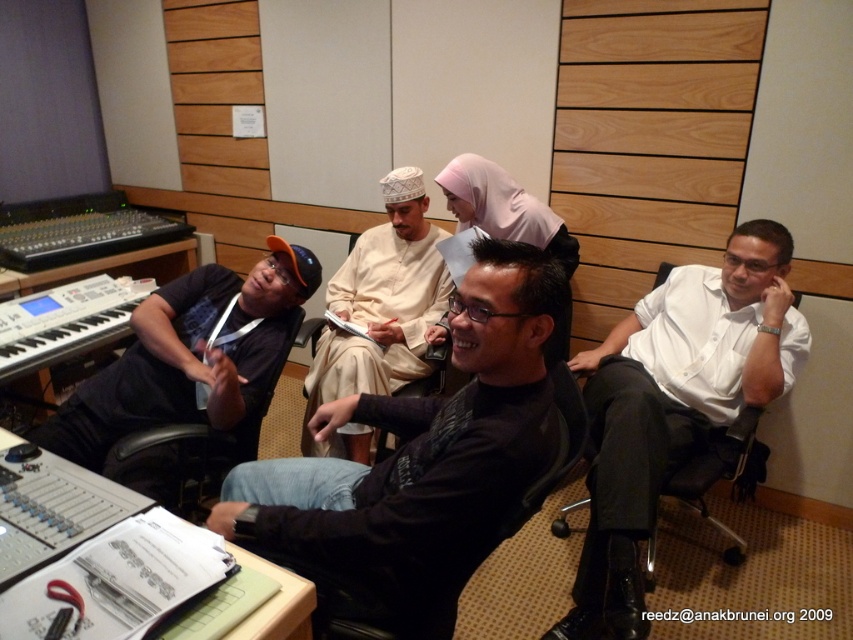
Can you confirm if brown textured chair at center is smaller than black leather chair at left?

Correct, brown textured chair at center occupies less space than black leather chair at left.

Between point (556, 387) and point (287, 342), which one is positioned in front?

Point (556, 387)

This screenshot has height=640, width=853. I want to click on brown textured chair at center, so click(x=556, y=456).

Between white shirt at right and brown textured chair at center, which one is positioned higher?

white shirt at right

Between white shirt at right and brown textured chair at center, which one has more height?

With more height is white shirt at right.

Does point (711, 308) come closer to viewer compared to point (531, 502)?

That is False.

Where is `white shirt at right`? This screenshot has height=640, width=853. white shirt at right is located at coordinates (674, 404).

Is black matte shirt at center closer to the viewer compared to beige cotton shirt at center?

Yes, black matte shirt at center is closer to the viewer.

Does black matte shirt at center have a greater width compared to beige cotton shirt at center?

Yes, black matte shirt at center is wider than beige cotton shirt at center.

What do you see at coordinates (419, 461) in the screenshot?
I see `black matte shirt at center` at bounding box center [419, 461].

Where is `black matte shirt at center`? The image size is (853, 640). black matte shirt at center is located at coordinates (419, 461).